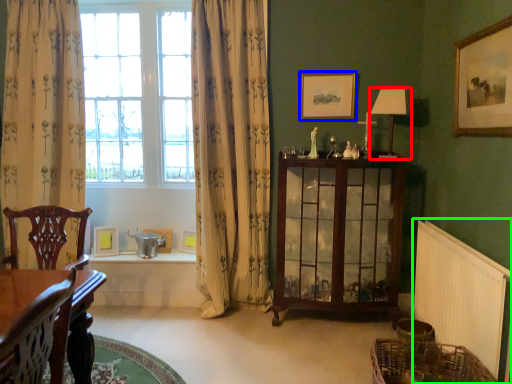
Question: Based on their relative distances, which object is nearer to lamp (highlighted by a red box)? Choose from picture frame (highlighted by a blue box) and radiator (highlighted by a green box).

Choices:
 (A) picture frame
 (B) radiator

Answer: (A)